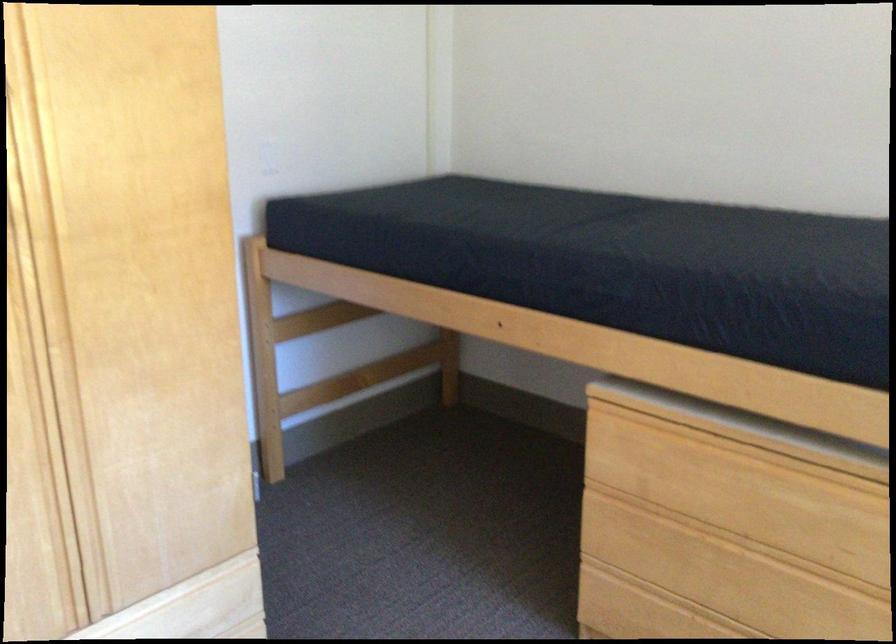
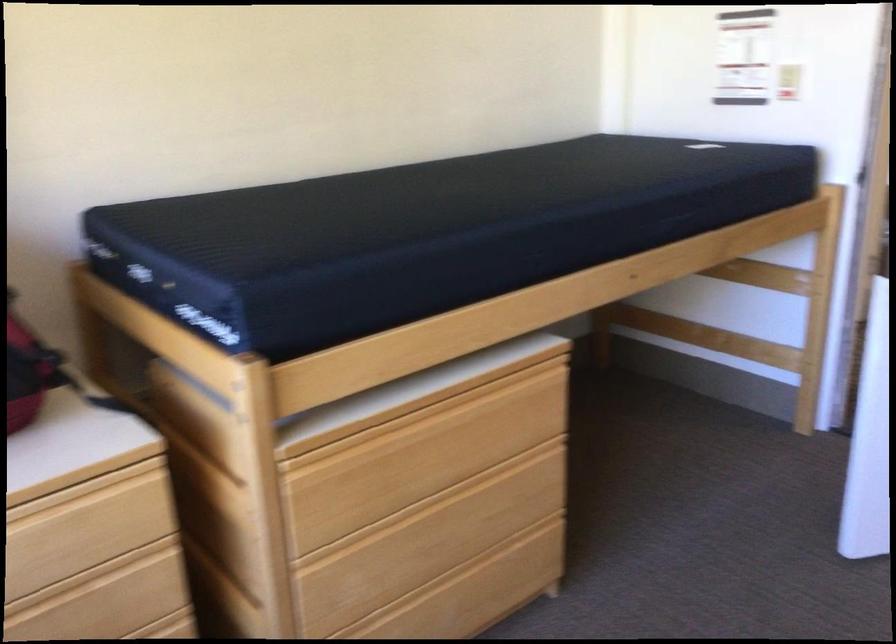
How did the camera likely rotate?

The camera rotated toward left-down.